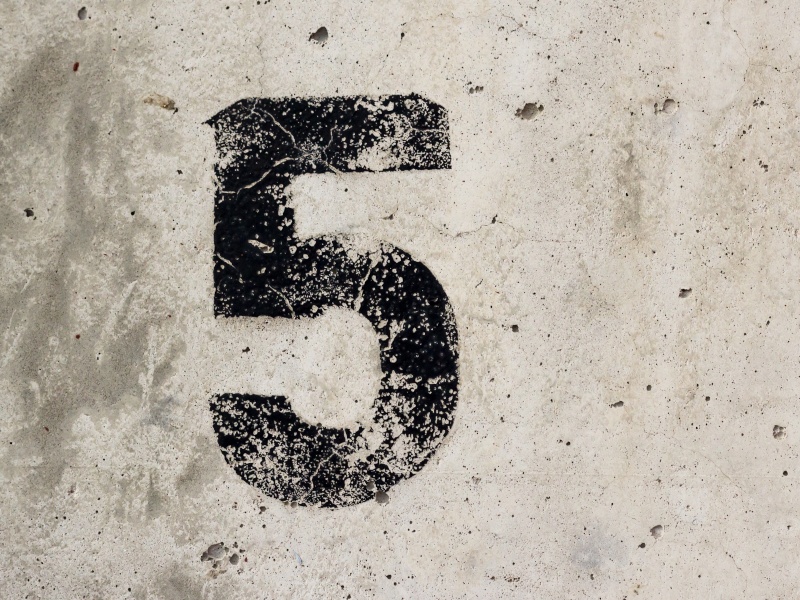
Where is `holes in wall`? The width and height of the screenshot is (800, 600). holes in wall is located at coordinates (320, 37), (525, 111), (666, 113).